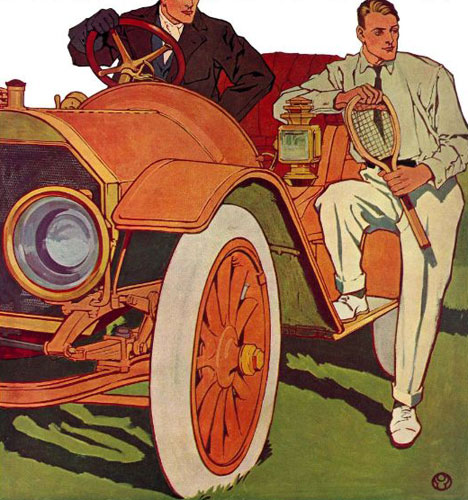
Locate an element on the screen. shoe is located at coordinates (349, 306), (399, 423).